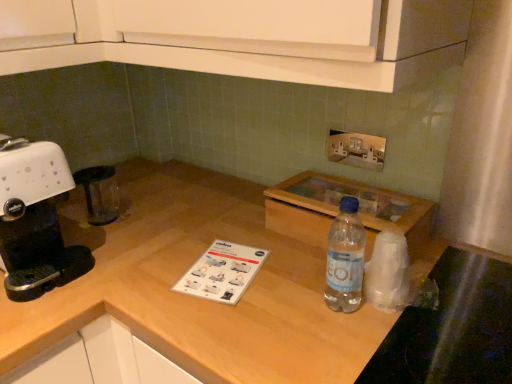
Question: Should I look upward or downward to see metallic silver outlet at upper center?

Choices:
 (A) down
 (B) up

Answer: (B)

Question: Is metallic silver outlet at upper center oriented towards wooden at center?

Choices:
 (A) yes
 (B) no

Answer: (B)

Question: Is metallic silver outlet at upper center thinner than wooden at center?

Choices:
 (A) yes
 (B) no

Answer: (A)

Question: Would you say metallic silver outlet at upper center contains wooden at center?

Choices:
 (A) no
 (B) yes

Answer: (A)

Question: Is metallic silver outlet at upper center bigger than wooden at center?

Choices:
 (A) yes
 (B) no

Answer: (B)

Question: Can you confirm if metallic silver outlet at upper center is shorter than wooden at center?

Choices:
 (A) no
 (B) yes

Answer: (B)

Question: Can you confirm if metallic silver outlet at upper center is positioned to the right of wooden at center?

Choices:
 (A) yes
 (B) no

Answer: (A)

Question: From the image's perspective, would you say white plastic coffee machine at left is shown under metallic silver outlet at upper center?

Choices:
 (A) yes
 (B) no

Answer: (A)

Question: Does white plastic coffee machine at left appear on the right side of metallic silver outlet at upper center?

Choices:
 (A) no
 (B) yes

Answer: (A)

Question: From a real-world perspective, is white plastic coffee machine at left on top of metallic silver outlet at upper center?

Choices:
 (A) yes
 (B) no

Answer: (B)

Question: From the image's perspective, is white plastic coffee machine at left on metallic silver outlet at upper center?

Choices:
 (A) yes
 (B) no

Answer: (B)

Question: Would you say white plastic coffee machine at left is a long distance from metallic silver outlet at upper center?

Choices:
 (A) no
 (B) yes

Answer: (A)

Question: Considering the relative sizes of white plastic coffee machine at left and metallic silver outlet at upper center in the image provided, is white plastic coffee machine at left smaller than metallic silver outlet at upper center?

Choices:
 (A) yes
 (B) no

Answer: (B)

Question: Does metallic silver outlet at upper center appear on the right side of transparent plastic bag at right?

Choices:
 (A) yes
 (B) no

Answer: (A)